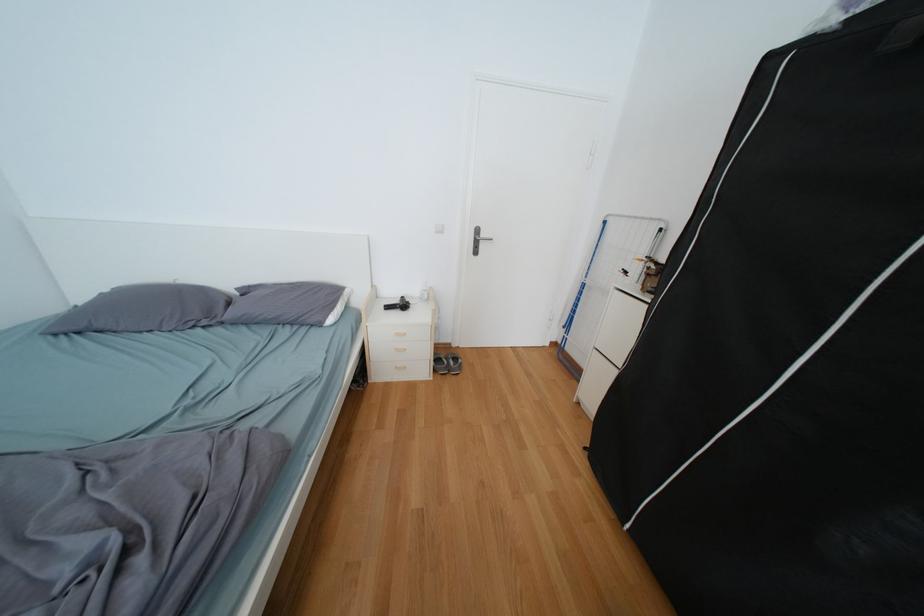
Image resolution: width=924 pixels, height=616 pixels. Describe the element at coordinates (481, 238) in the screenshot. I see `a silver door handle` at that location.